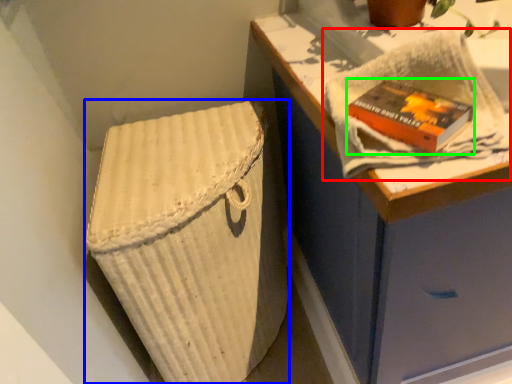
Question: Considering the real-world distances, which object is closest to bath towel (highlighted by a red box)? laundry basket (highlighted by a blue box) or paperback book (highlighted by a green box).

Choices:
 (A) laundry basket
 (B) paperback book

Answer: (B)